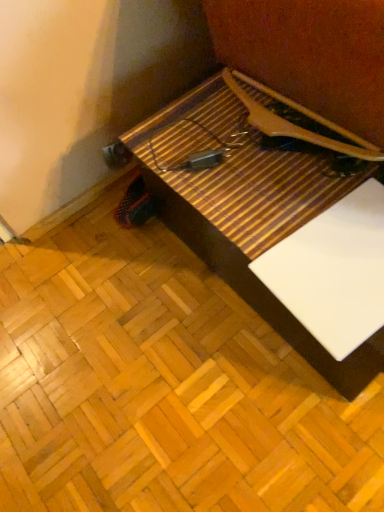
Question: Considering their positions, is white matte paper at lower right located in front of or behind wooden table at center?

Choices:
 (A) front
 (B) behind

Answer: (B)

Question: Based on their sizes in the image, would you say white matte paper at lower right is bigger or smaller than wooden table at center?

Choices:
 (A) big
 (B) small

Answer: (B)

Question: Would you say white matte paper at lower right is to the left or to the right of wooden table at center in the picture?

Choices:
 (A) right
 (B) left

Answer: (A)

Question: Is wooden table at center inside or outside of white matte paper at lower right?

Choices:
 (A) outside
 (B) inside

Answer: (A)

Question: Looking at the image, does wooden table at center seem bigger or smaller compared to white matte paper at lower right?

Choices:
 (A) big
 (B) small

Answer: (A)

Question: From the image's perspective, is wooden table at center above or below white matte paper at lower right?

Choices:
 (A) below
 (B) above

Answer: (B)

Question: Is wooden table at center wider or thinner than white matte paper at lower right?

Choices:
 (A) wide
 (B) thin

Answer: (A)